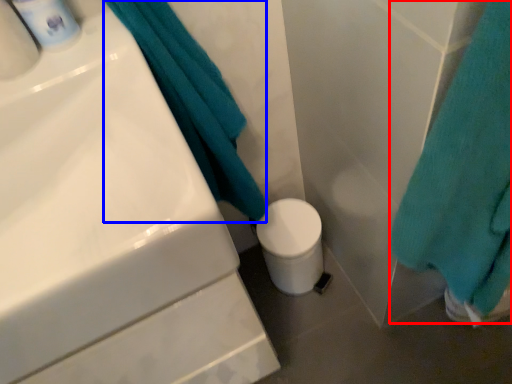
Question: Which of the following is the farthest to the observer, bath towel (highlighted by a red box) or bath towel (highlighted by a blue box)?

Choices:
 (A) bath towel
 (B) bath towel

Answer: (B)